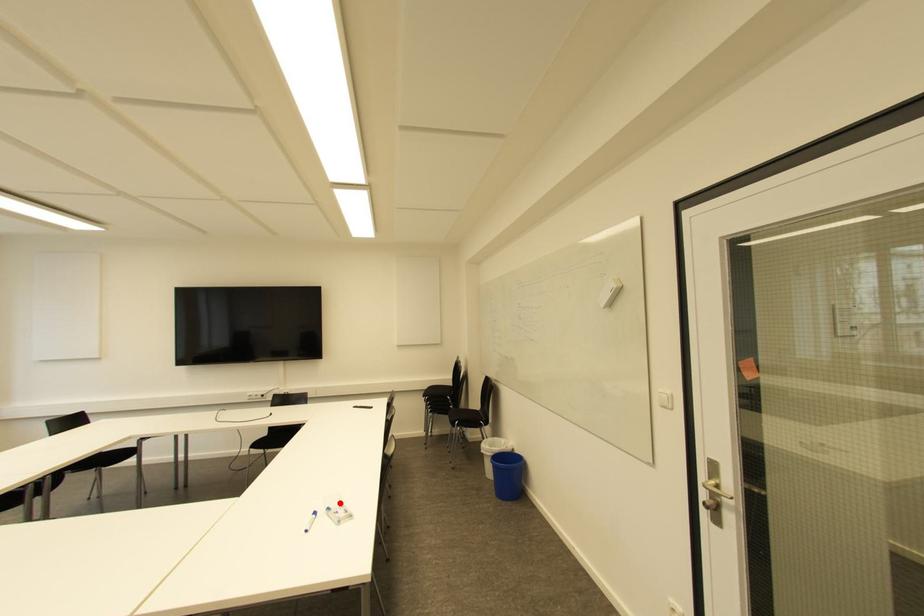
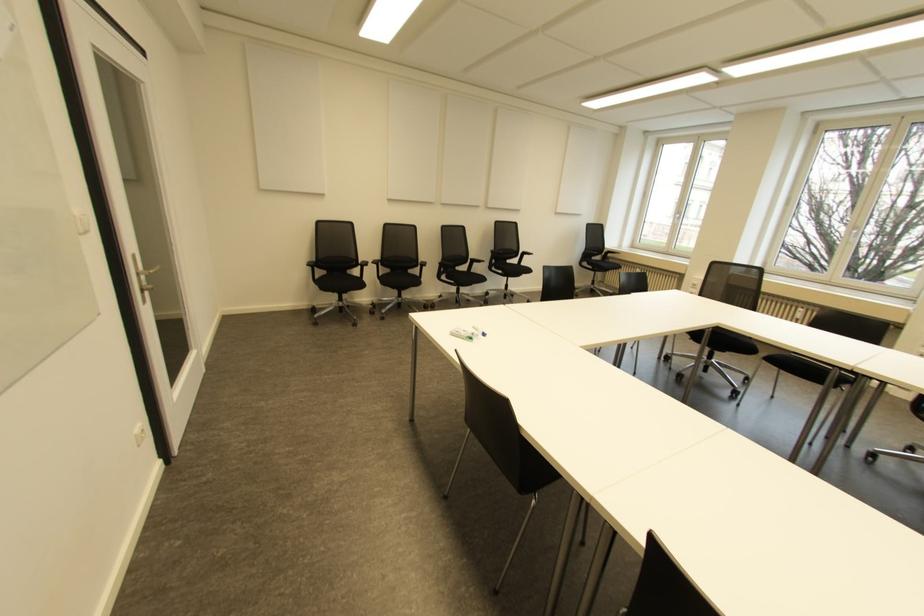
Find the pixel in the second image that matches the highlighted location in the first image.

(470, 338)